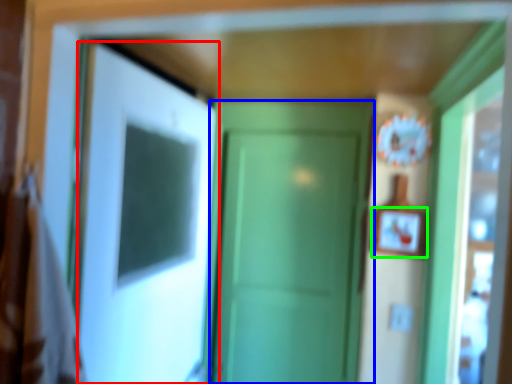
Question: Estimate the real-world distances between objects in this image. Which object is closer to door (highlighted by a red box), door (highlighted by a blue box) or picture frame (highlighted by a green box)?

Choices:
 (A) door
 (B) picture frame

Answer: (A)